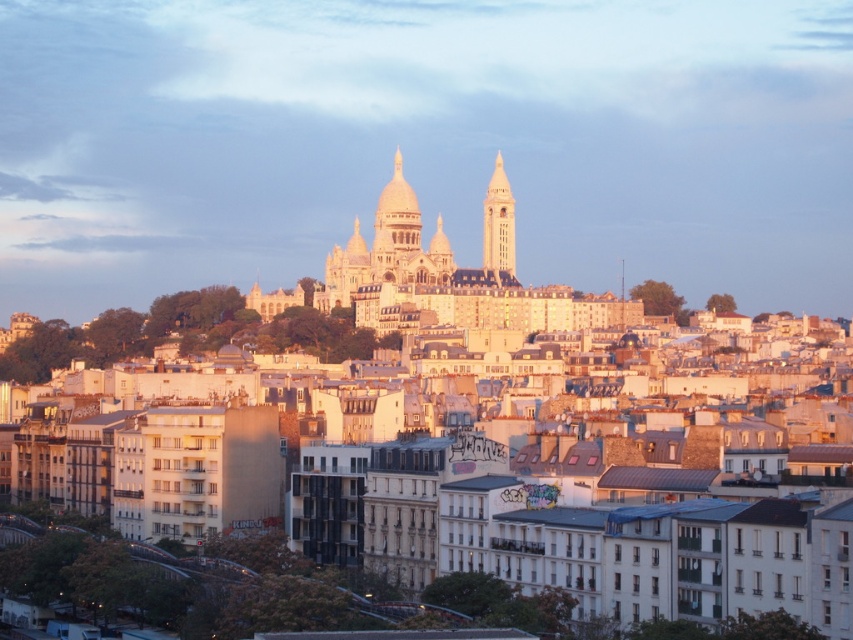
Is white stone dome at center wider than white stone tower at upper center?

Indeed, white stone dome at center has a greater width compared to white stone tower at upper center.

Who is positioned more to the left, white stone dome at center or white stone tower at upper center?

Positioned to the left is white stone dome at center.

Between point (422, 272) and point (503, 186), which one is positioned in front?

Point (422, 272) is in front.

Find the location of a particular element. The image size is (853, 640). white stone dome at center is located at coordinates pyautogui.click(x=395, y=228).